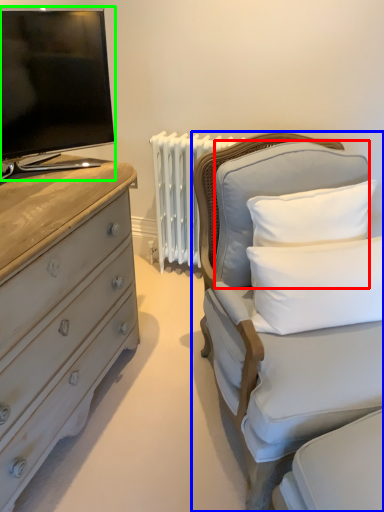
Question: Which object is positioned farthest from pillow (highlighted by a red box)? Select from furniture (highlighted by a blue box) and television (highlighted by a green box).

Choices:
 (A) furniture
 (B) television

Answer: (B)